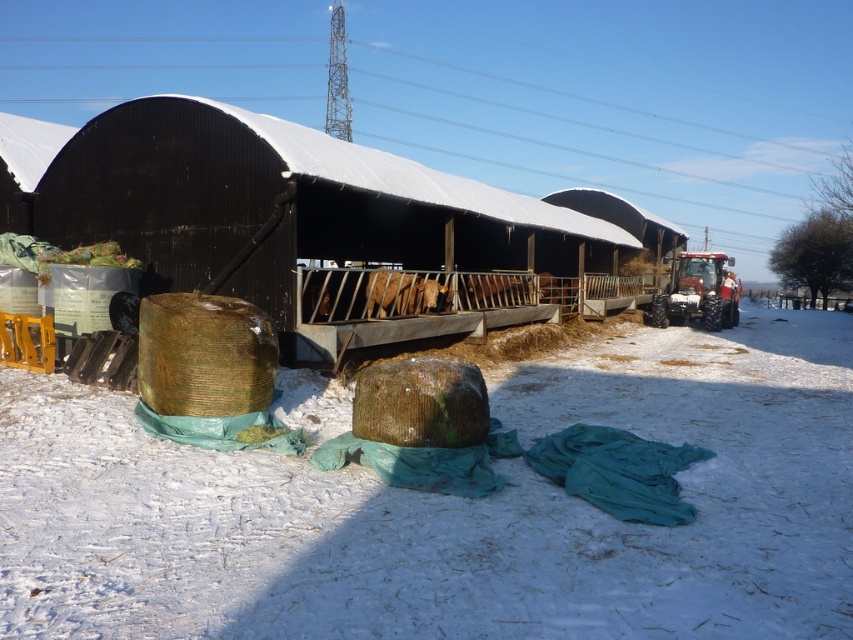
Question: Does white fluffy snow at lower center have a larger size compared to black corrugated metal barn at center?

Choices:
 (A) yes
 (B) no

Answer: (B)

Question: Which of the following is the closest to the observer?

Choices:
 (A) (93, 211)
 (B) (51, 448)

Answer: (B)

Question: From the image, what is the correct spatial relationship of white fluffy snow at lower center in relation to black corrugated metal barn at center?

Choices:
 (A) left
 (B) right

Answer: (B)

Question: Which object is closer to the camera taking this photo?

Choices:
 (A) white fluffy snow at lower center
 (B) black corrugated metal barn at center

Answer: (A)

Question: Is white fluffy snow at lower center positioned behind black corrugated metal barn at center?

Choices:
 (A) no
 (B) yes

Answer: (A)